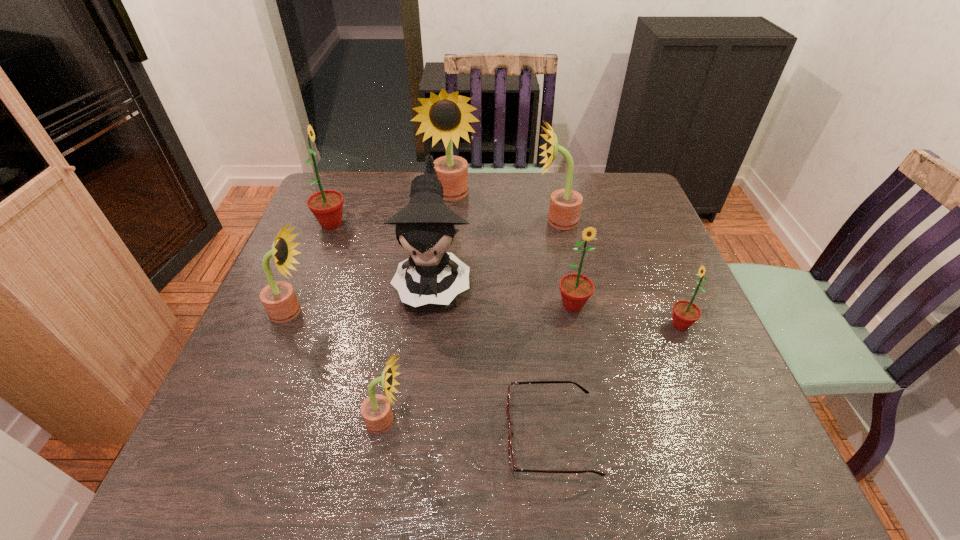
At what (x,y) coordinates should I click in order to perform the action: click on the biggest yellow sunflower. Please return your answer as a coordinate pair (x, y). The width and height of the screenshot is (960, 540). Looking at the image, I should click on pos(446,116).

Where is `the tallest sunflower`? The height and width of the screenshot is (540, 960). the tallest sunflower is located at coordinates (446, 116).

You are a GUI agent. You are given a task and a screenshot of the screen. Output one action in this format:
    pyautogui.click(x=<x>, y=<y>)
    Task: Click on the second biggest yellow sunflower
    The width and height of the screenshot is (960, 540).
    Given the screenshot: What is the action you would take?
    pyautogui.click(x=565, y=204)

The image size is (960, 540). Find the location of `the biggest green sunflower`. the biggest green sunflower is located at coordinates (327, 205).

This screenshot has width=960, height=540. I want to click on the leftmost green sunflower, so click(x=327, y=205).

You are a GUI agent. You are given a task and a screenshot of the screen. Output one action in this format:
    pyautogui.click(x=<x>, y=<y>)
    Task: Click on the doll
    This screenshot has height=540, width=960.
    Given the screenshot: What is the action you would take?
    pyautogui.click(x=425, y=228)

Image resolution: width=960 pixels, height=540 pixels. I want to click on the third biggest yellow sunflower, so click(x=278, y=298).

Where is `the second nearest yellow sunflower`? Image resolution: width=960 pixels, height=540 pixels. the second nearest yellow sunflower is located at coordinates (278, 298).

You are a GUI agent. You are given a task and a screenshot of the screen. Output one action in this format:
    pyautogui.click(x=<x>, y=<y>)
    Task: Click on the second smallest green sunflower
    This screenshot has width=960, height=540.
    Given the screenshot: What is the action you would take?
    pyautogui.click(x=576, y=289)

Locate an element on the screen. The image size is (960, 540). the smallest yellow sunflower is located at coordinates (376, 411).